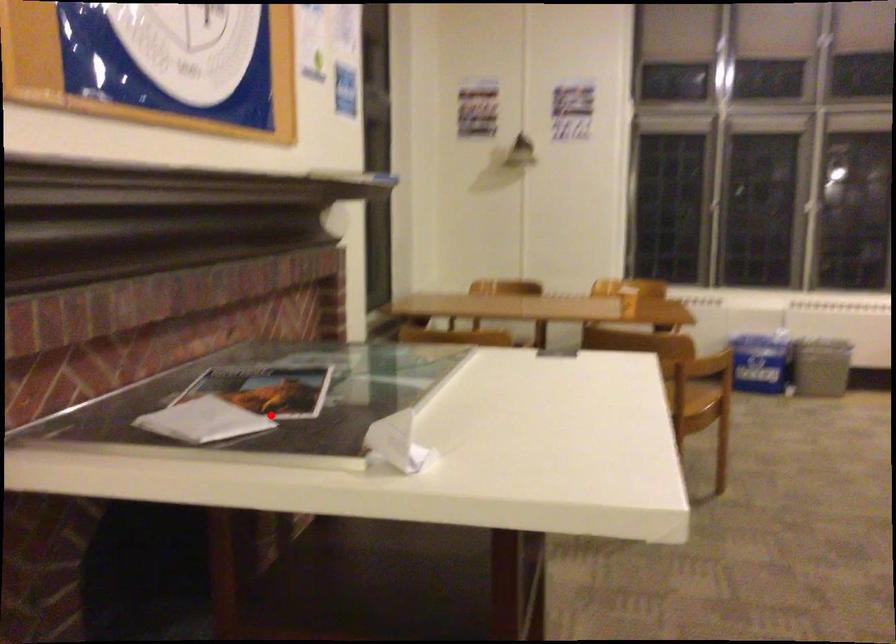
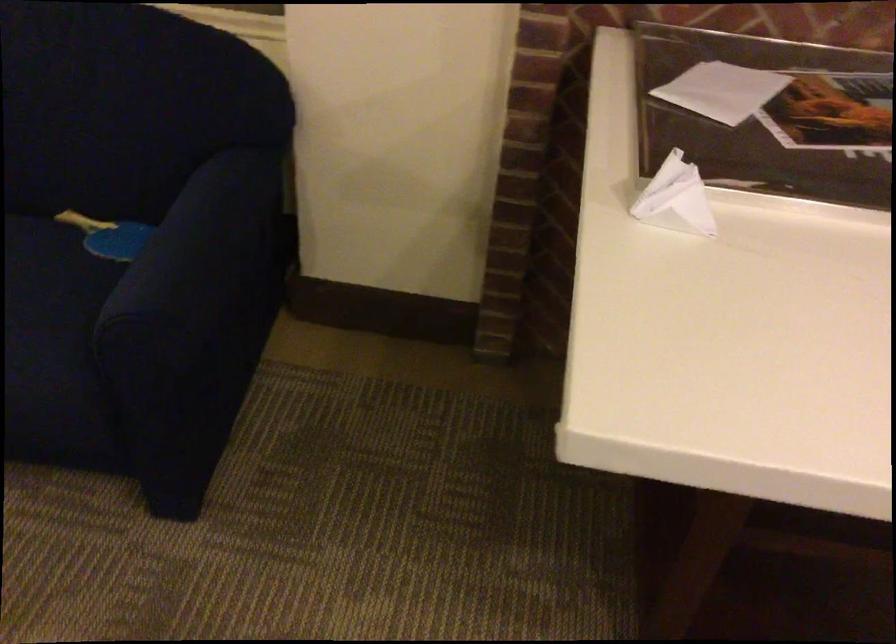
Question: A red point is marked in image1. In image2, is the corresponding 3D point closer to the camera or farther? Reply with the corresponding letter.

Choices:
 (A) The corresponding 3D point is closer.
 (B) The corresponding 3D point is farther.

Answer: (A)